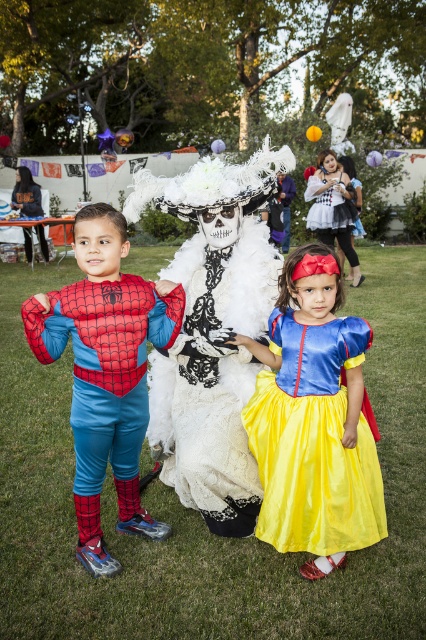
Which is behind, point (94, 401) or point (322, 179)?

The point (322, 179) is more distant.

Is point (92, 212) less distant than point (316, 230)?

That is True.

Which is behind, point (103, 378) or point (317, 189)?

Point (317, 189)

Identify the location of matte red spider-man costume at left. This screenshot has height=640, width=426. (106, 371).

Measure the distance between silky yellow dress at center and matte red spider-man costume at left.

silky yellow dress at center is 70.83 centimeters away from matte red spider-man costume at left.

Does point (307, 246) come behind point (57, 353)?

Yes, it is behind point (57, 353).

You are a GUI agent. You are given a task and a screenshot of the screen. Output one action in this format:
    pyautogui.click(x=<x>, y=<y>)
    Task: Click on the silky yellow dress at center
    
    Given the screenshot: What is the action you would take?
    pyautogui.click(x=313, y=422)

Is white lace dress at center smaller than matte white dress at center?

No.

Who is more distant from viewer, (127, 212) or (345, 211)?

Positioned behind is point (345, 211).

Which is behind, point (198, 298) or point (310, 209)?

Point (310, 209)

Where is `white lace dress at center`? white lace dress at center is located at coordinates (213, 332).